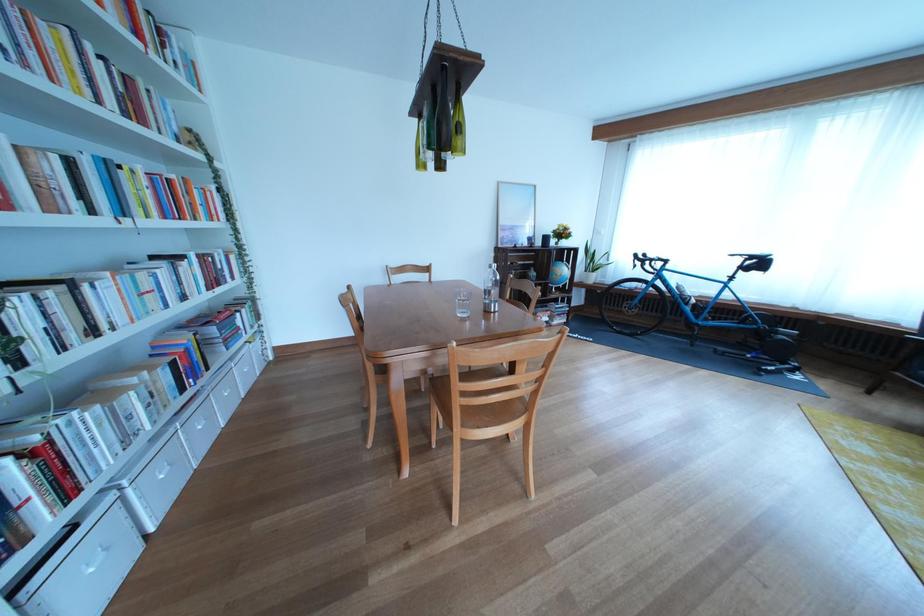
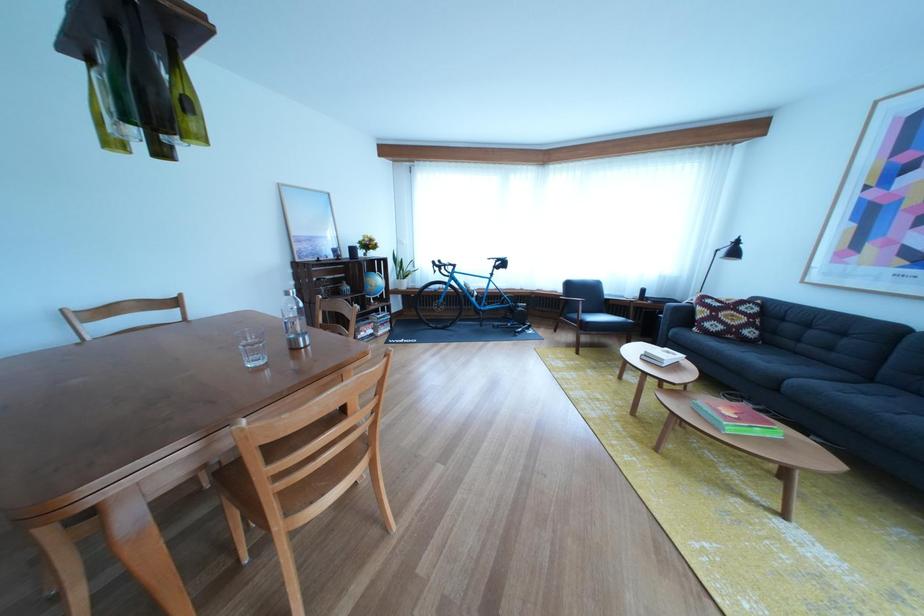
The point at (499, 310) is marked in the first image. Where is the corresponding point in the second image?

(302, 346)